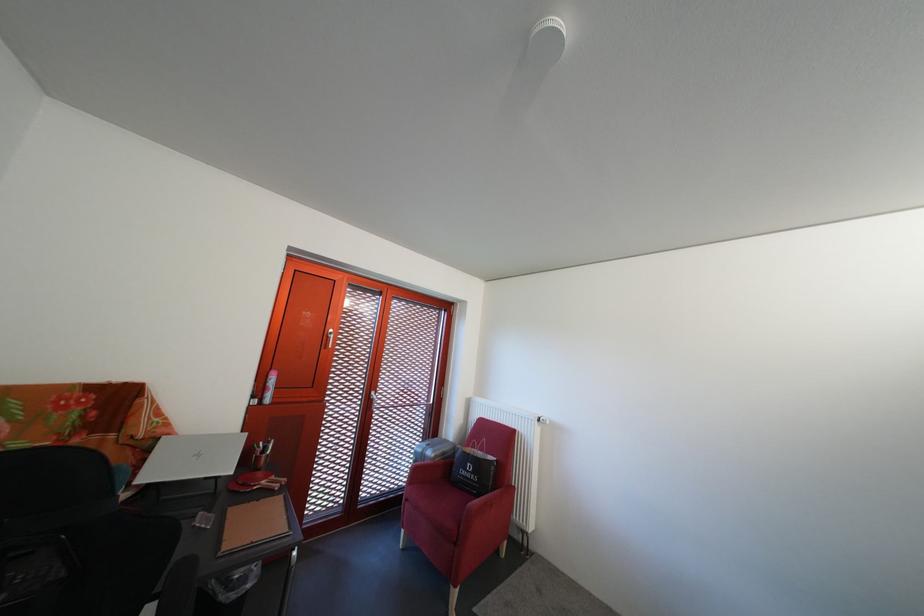
Where is `chair sitting surface`? The width and height of the screenshot is (924, 616). chair sitting surface is located at coordinates (439, 503).